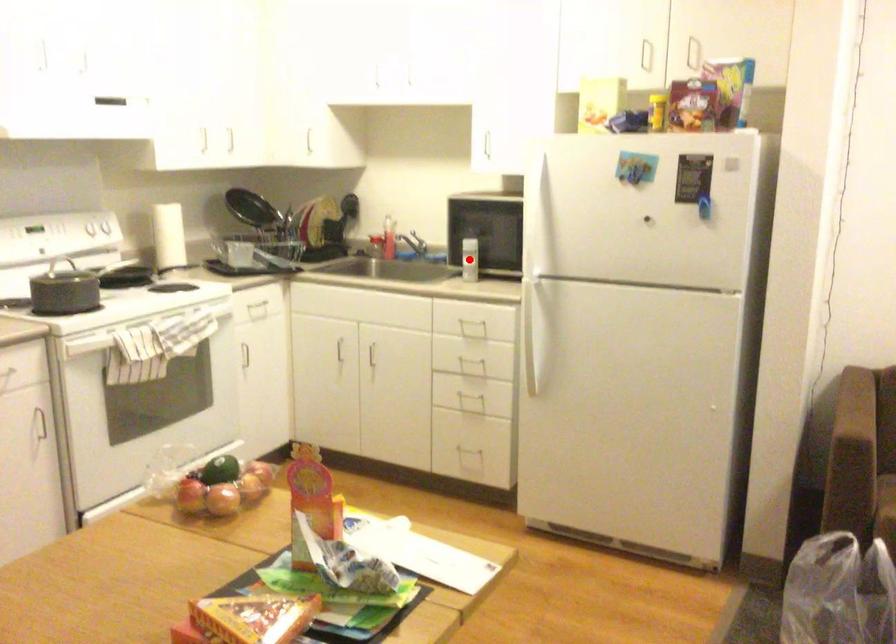
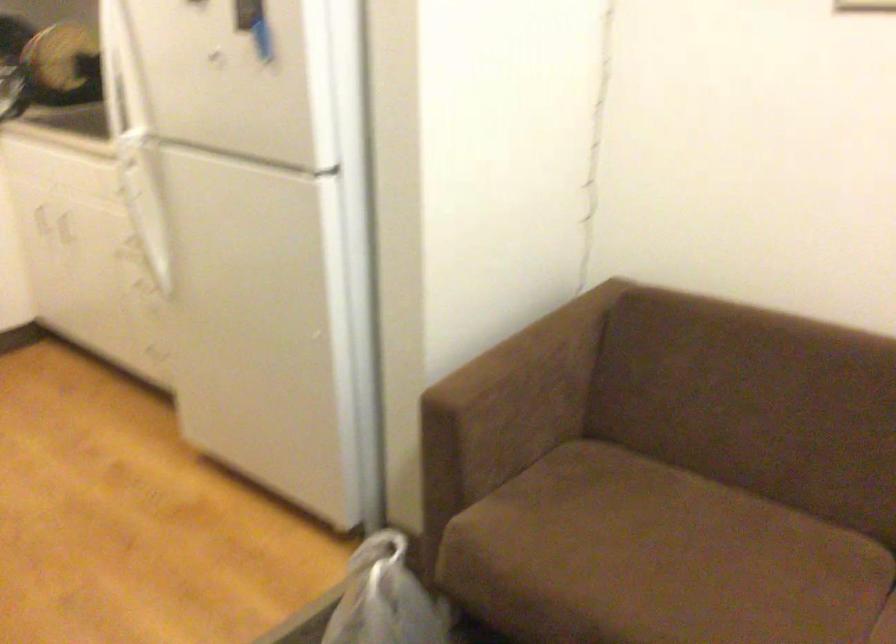
Question: I am providing you with two images of the same scene from different viewpoints. A red point is marked on the first image. Can you still see the location of the red point in image 2?

Choices:
 (A) Yes
 (B) No

Answer: (B)